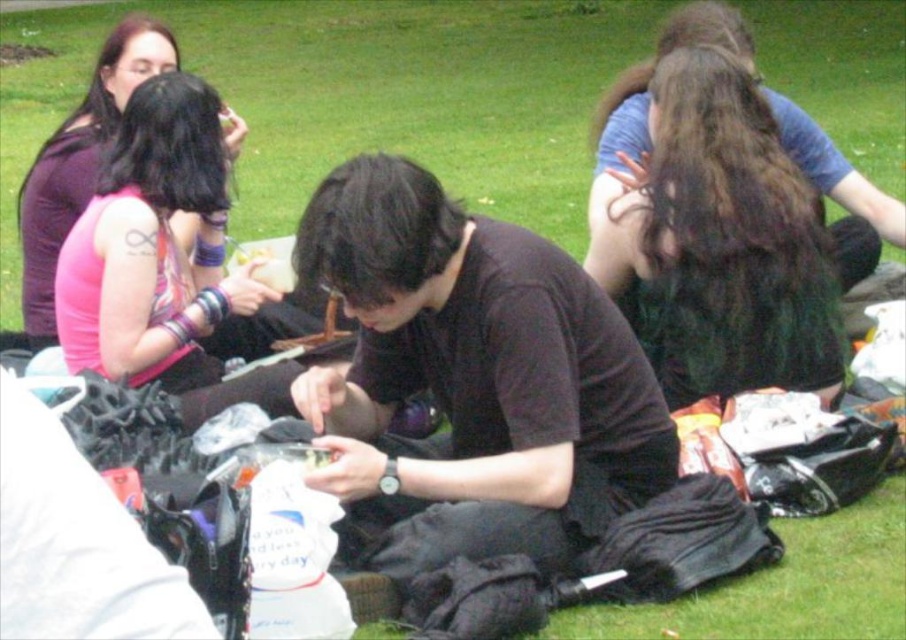
Is point (827, 244) more distant than point (135, 67)?

No, (827, 244) is closer to viewer.

Is dark brown hair at upper right shorter than pink fabric bracelet at upper left?

No.

Describe the element at coordinates (724, 240) in the screenshot. I see `dark brown hair at upper right` at that location.

Locate an element on the screen. dark brown hair at upper right is located at coordinates (724, 240).

Is black matte shirt at center further to camera compared to pink fabric bracelet at upper left?

No, black matte shirt at center is in front of pink fabric bracelet at upper left.

Is black matte shirt at center below pink fabric bracelet at upper left?

Correct, black matte shirt at center is located below pink fabric bracelet at upper left.

Is point (487, 467) closer to camera compared to point (51, 337)?

That is True.

Where is `black matte shirt at center`? Image resolution: width=906 pixels, height=640 pixels. black matte shirt at center is located at coordinates (470, 380).

Does black matte shirt at center have a smaller size compared to dark brown hair at upper right?

No.

Can you confirm if black matte shirt at center is positioned below dark brown hair at upper right?

Yes.

Does point (330, 253) lie behind point (768, 316)?

No.

Where is `black matte shirt at center`? black matte shirt at center is located at coordinates (470, 380).